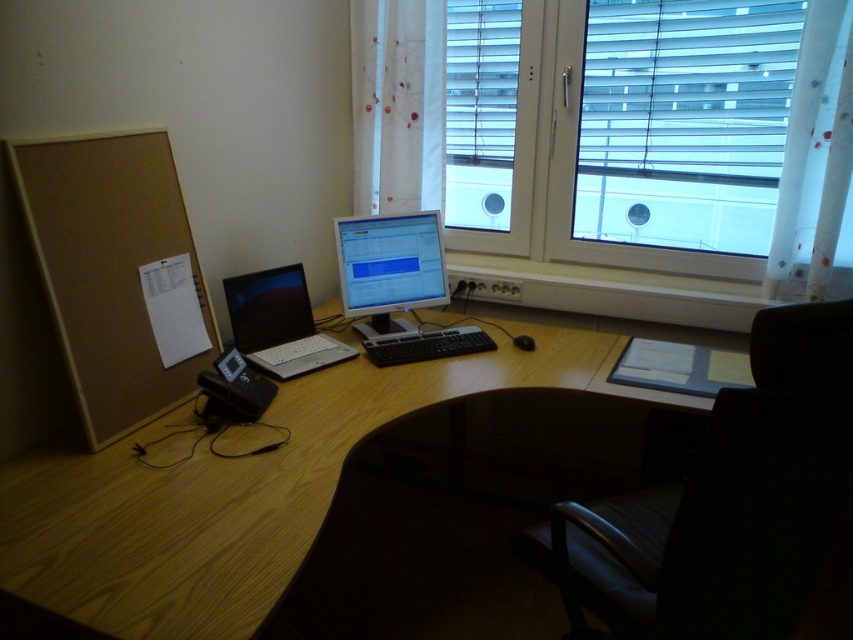
You are a person who needs to reach the black matte mouse at center from the black leather swivel chair at lower right. Can you comfortably reach it without moving your chair?

The distance between the black leather swivel chair at lower right and the black matte mouse at center is 96.30 centimeters. A typical comfortable reaching distance for a person is around 75 centimeters, so you may need to adjust your chair or move closer to comfortably reach the mouse.

You are an office worker who needs to sit down at the desk. There is a black leather swivel chair at lower right and a black matte mouse at center. Which object is wider?

The black leather swivel chair at lower right is wider than the black matte mouse at center.